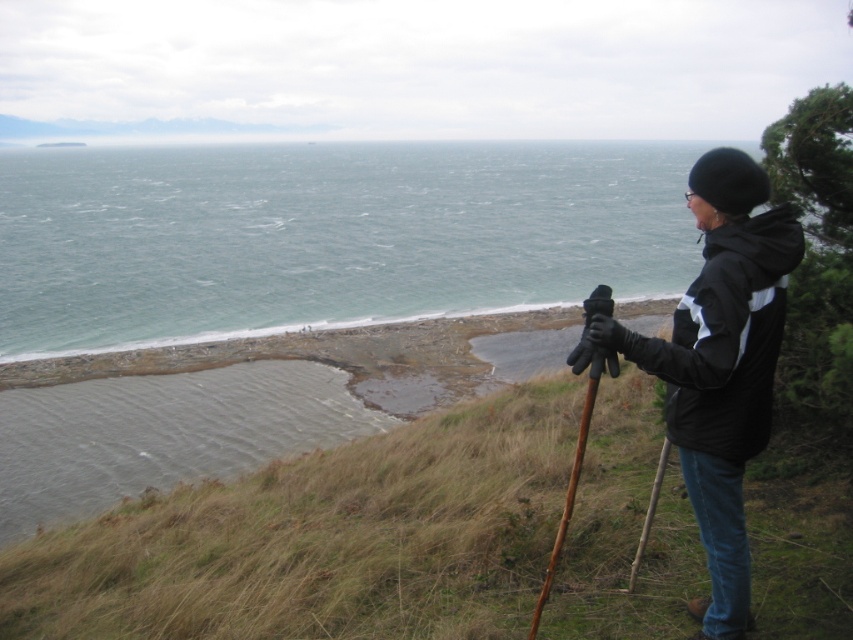
You are a photographer setting up your equipment on the grassy hillside. You need to place your tripod on the green grassy at lower left and the black matte jacket at center right. Which surface will require you to adjust the tripod legs to a shorter height?

The green grassy at lower left is shorter than the black matte jacket at center right, so you will need to adjust the tripod legs to a shorter height when placing it on the green grassy at lower left to ensure stability.